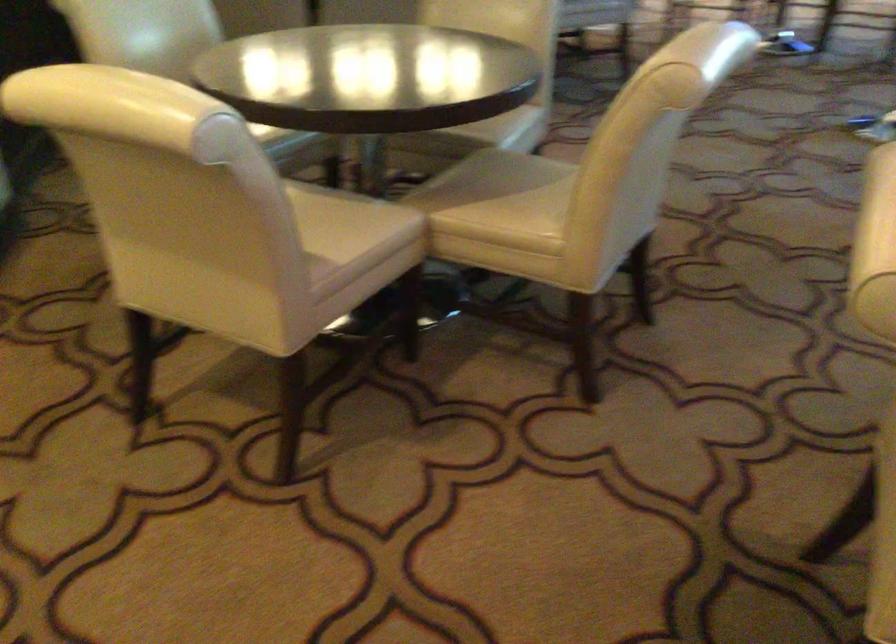
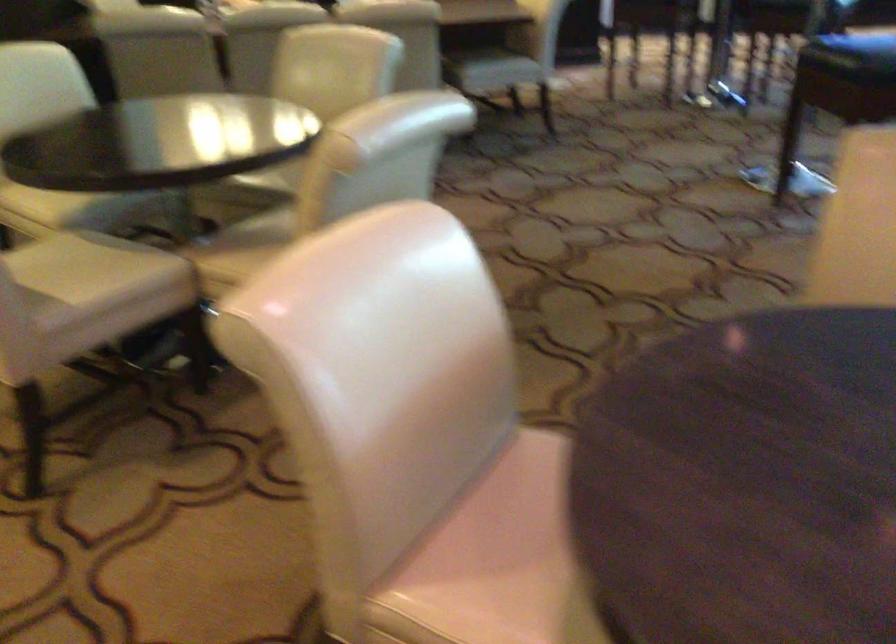
In the second image, find the point that corresponds to [478,183] in the first image.

(259, 234)